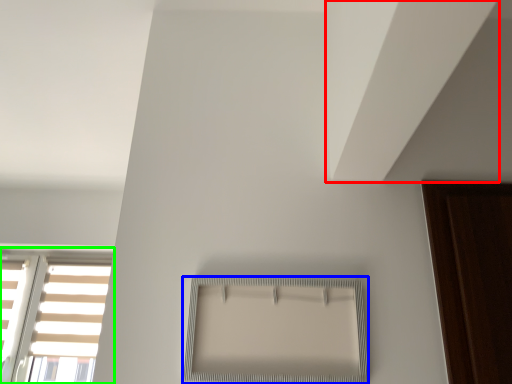
Question: Estimate the real-world distances between objects in this image. Which object is closer to blind (highlighted by a red box), window (highlighted by a blue box) or window (highlighted by a green box)?

Choices:
 (A) window
 (B) window

Answer: (A)